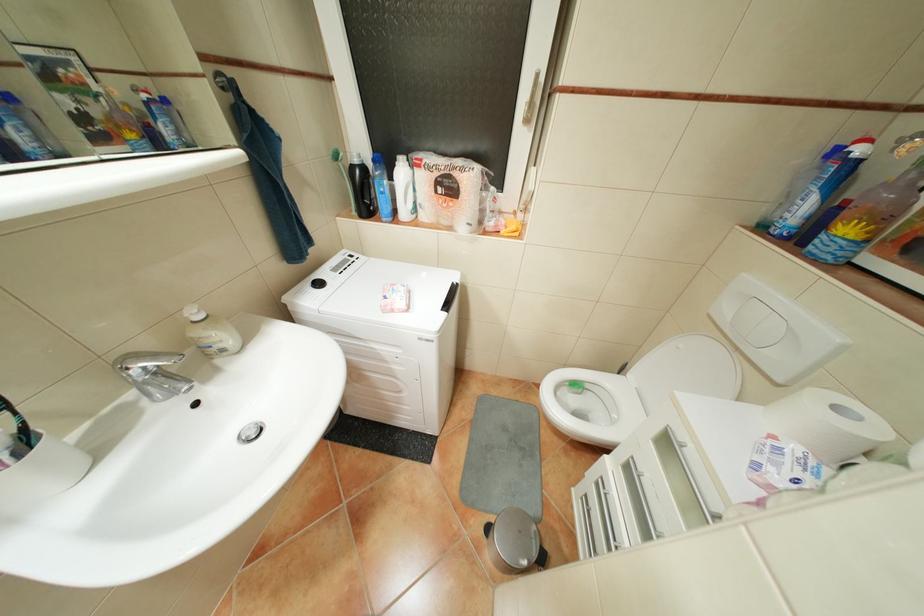
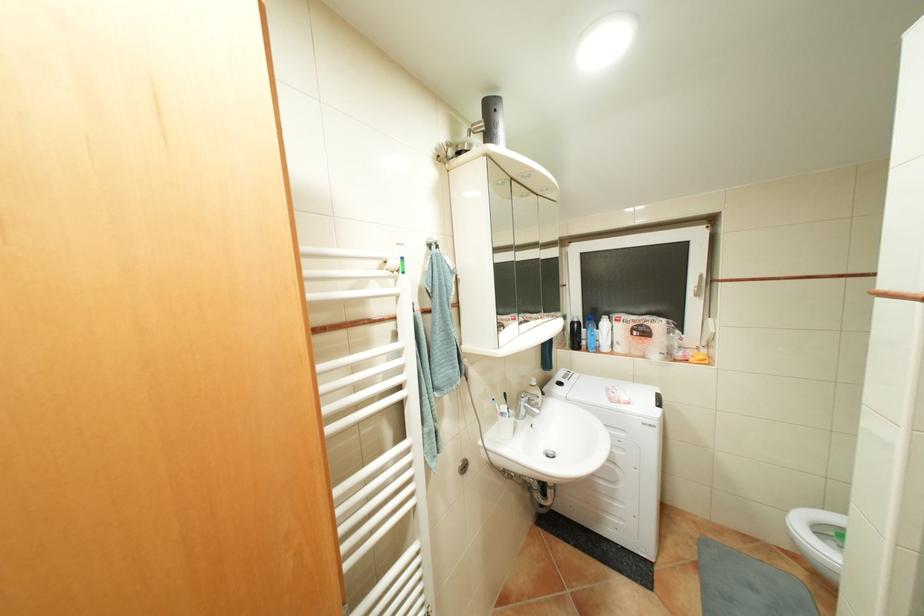
First-person continuous shooting, in which direction is the camera rotating?

The rotation direction of the camera is left-up.